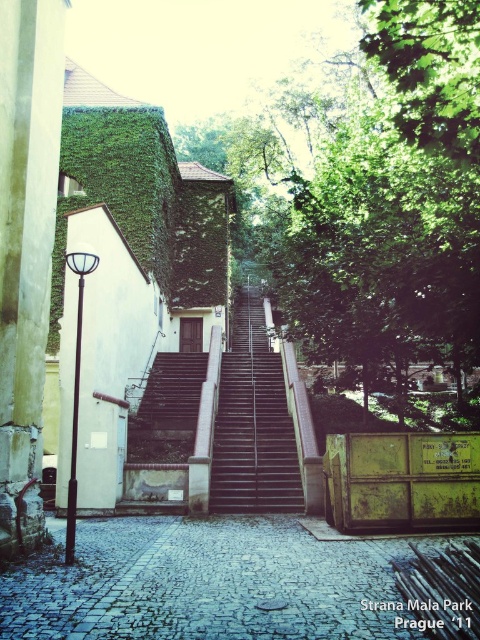
Which is more to the left, green leafy tree at center or dark gray concrete stairs at center?

From the viewer's perspective, dark gray concrete stairs at center appears more on the left side.

Is green leafy tree at center positioned before dark gray concrete stairs at center?

Yes, green leafy tree at center is in front of dark gray concrete stairs at center.

Is point (387, 93) less distant than point (168, 388)?

No, (387, 93) is further to viewer.

Find the location of a particular element. green leafy tree at center is located at coordinates (381, 209).

Does cobblestone alley at center appear over dark gray concrete stairs at center?

Actually, cobblestone alley at center is below dark gray concrete stairs at center.

Who is more distant from viewer, (24, 588) or (144, 419)?

Positioned behind is point (144, 419).

Who is more forward, (x=121, y=554) or (x=168, y=400)?

Point (x=121, y=554) is in front.

What are the coordinates of `cobblestone alley at center` in the screenshot? It's located at (206, 582).

Who is positioned more to the left, green leafy tree at center or black metal stairs at center?

From the viewer's perspective, black metal stairs at center appears more on the left side.

Does green leafy tree at center come in front of black metal stairs at center?

That is True.

Locate an element on the screen. The image size is (480, 640). green leafy tree at center is located at coordinates (381, 209).

Locate an element on the screen. The width and height of the screenshot is (480, 640). green leafy tree at center is located at coordinates (381, 209).